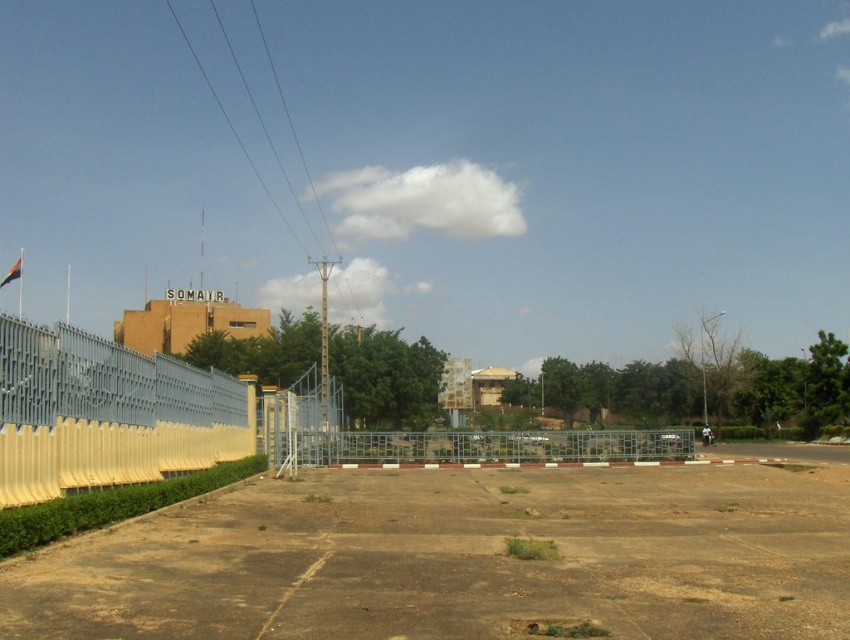
Which is below, brown dirt field at lower center or metallic grid fence at center?

metallic grid fence at center

Between point (667, 568) and point (586, 433), which one is positioned behind?

The point (586, 433) is more distant.

Is point (497, 490) closer to viewer compared to point (377, 454)?

Yes, point (497, 490) is in front of point (377, 454).

This screenshot has width=850, height=640. Find the location of `brown dirt field at lower center`. brown dirt field at lower center is located at coordinates (459, 557).

Can you confirm if metallic silver fence at left is shorter than metallic grid fence at center?

Result: Incorrect, metallic silver fence at left's height does not fall short of metallic grid fence at center's.

From the picture: Which is more to the left, metallic silver fence at left or metallic grid fence at center?

metallic silver fence at left is more to the left.

Is point (63, 476) in front of point (537, 433)?

Yes, point (63, 476) is closer to viewer.

I want to click on metallic silver fence at left, so click(106, 413).

Is the position of brown dirt field at lower center less distant than that of metallic silver fence at left?

Yes.

Is brown dirt field at lower center above metallic silver fence at left?

Actually, brown dirt field at lower center is below metallic silver fence at left.

Is point (445, 506) closer to camera compared to point (194, 419)?

Yes, it is.

What are the coordinates of `brown dirt field at lower center` in the screenshot? It's located at (459, 557).